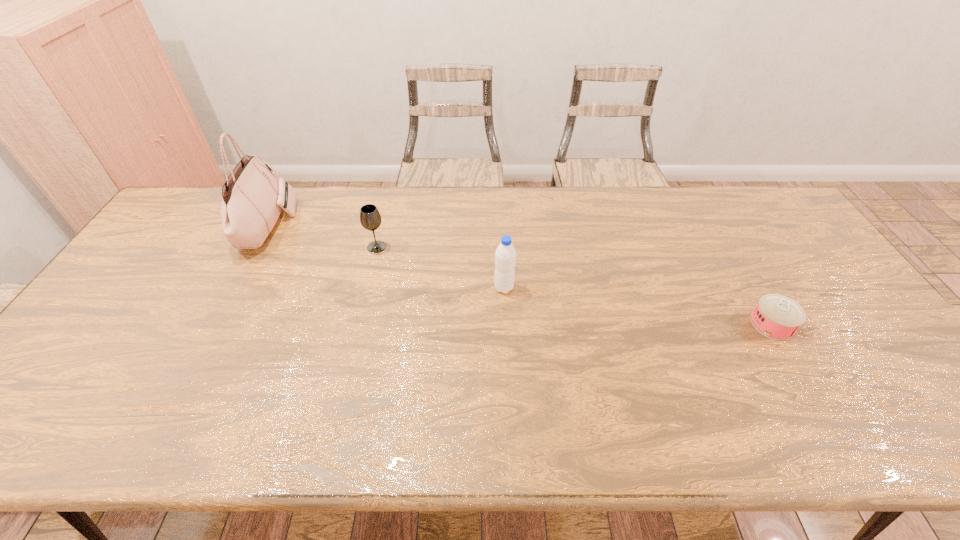
The height and width of the screenshot is (540, 960). What are the coordinates of `free space that satisfies the following two spatial constraints: 1. on the side of the leftmost object with the attached pouch; 2. on the right side of the third tallest object` in the screenshot? It's located at (257, 247).

The image size is (960, 540). What are the coordinates of `vacant space that satisfies the following two spatial constraints: 1. on the side of the handbag with the attached pouch; 2. on the left side of the second shortest object` in the screenshot? It's located at (x=257, y=247).

Locate an element on the screen. The width and height of the screenshot is (960, 540). free spot that satisfies the following two spatial constraints: 1. on the side of the can with the attached pouch; 2. on the left side of the handbag is located at coordinates (217, 324).

The height and width of the screenshot is (540, 960). In order to click on free space that satisfies the following two spatial constraints: 1. on the side of the second object from left to right with the attached pouch; 2. on the right side of the leftmost object in this screenshot , I will do `click(257, 247)`.